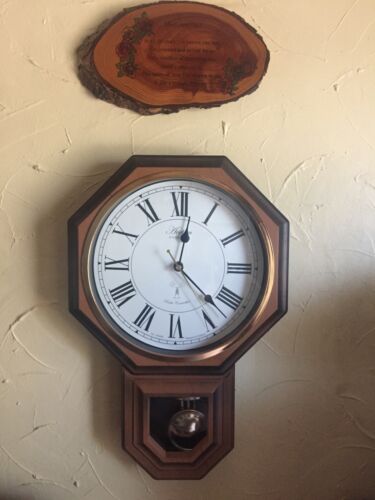
This screenshot has height=500, width=375. Find the location of `top of clock`. top of clock is located at coordinates (180, 164).